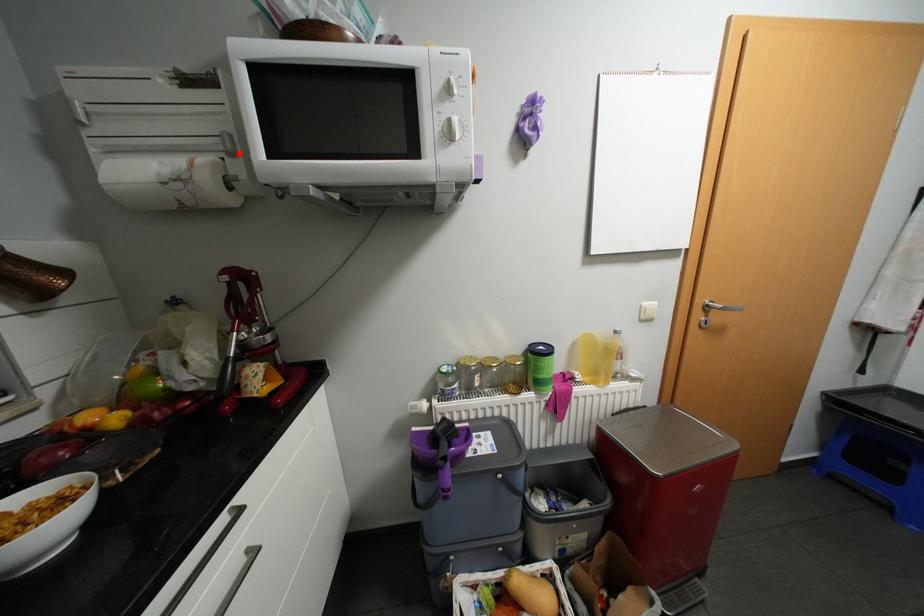
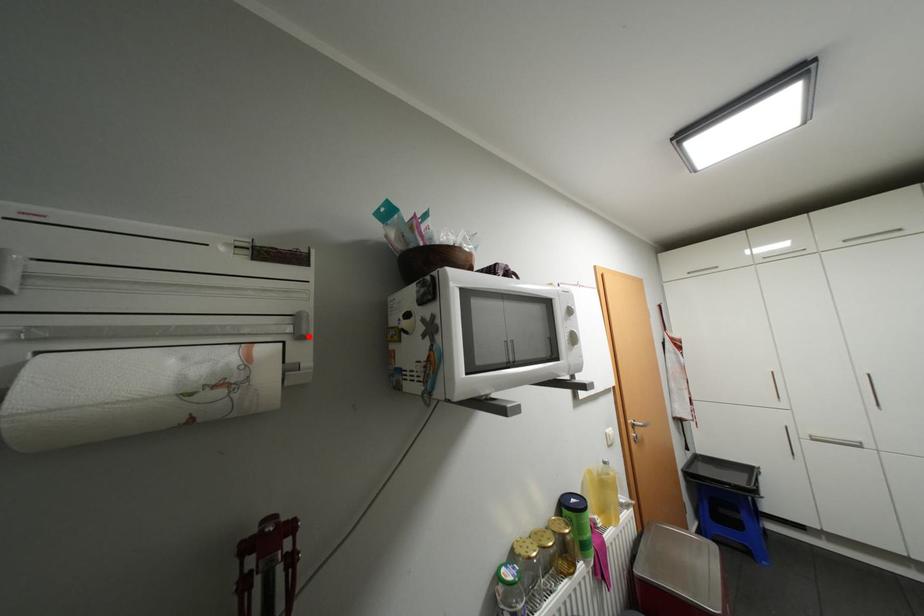
I am providing you with two images of the same scene from different viewpoints. A red point is marked on the first image and another point is marked on the second image. Do the highlighted points in image1 and image2 indicate the same real-world spot?

Yes